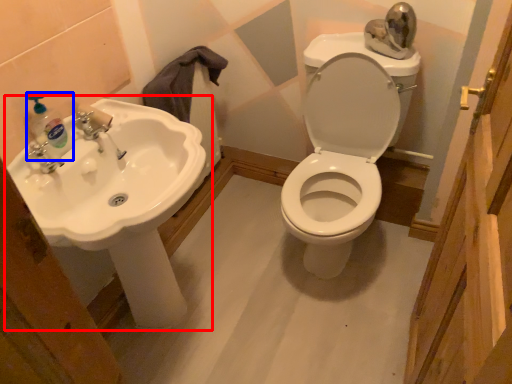
Question: Which of the following is the farthest to the observer, sink (highlighted by a red box) or soap dispenser (highlighted by a blue box)?

Choices:
 (A) sink
 (B) soap dispenser

Answer: (B)